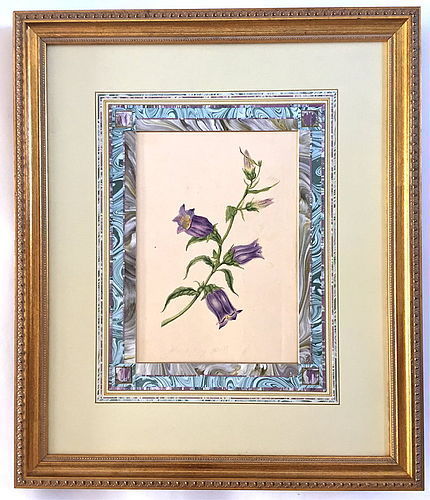
The image size is (430, 500). Find the location of `wooden picture frame`. wooden picture frame is located at coordinates (32, 285), (175, 469), (403, 397), (264, 33).